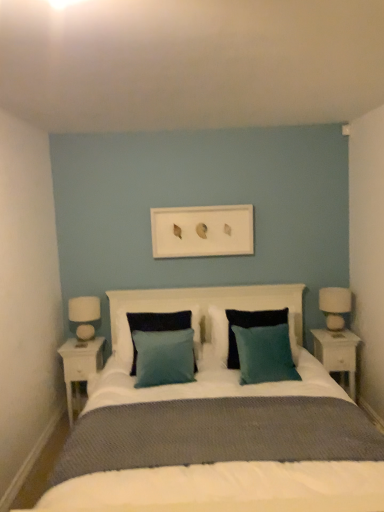
Question: Which direction should I rotate to look at teal fabric pillow at center, placed as the 2th pillow when sorted from right to left?

Choices:
 (A) left
 (B) right

Answer: (B)

Question: Is teal fabric pillow at center, which ranks as the first pillow in right-to-left order, surrounding white wood nightstand at left, the 1th nightstand positioned from the left?

Choices:
 (A) yes
 (B) no

Answer: (B)

Question: Is teal fabric pillow at center, the third pillow positioned from the left, behind white wood nightstand at left, acting as the 2th nightstand starting from the right?

Choices:
 (A) no
 (B) yes

Answer: (A)

Question: Does teal fabric pillow at center, which ranks as the first pillow in right-to-left order, have a lesser width compared to white wood nightstand at left, the 1th nightstand positioned from the left?

Choices:
 (A) yes
 (B) no

Answer: (B)

Question: From a real-world perspective, is teal fabric pillow at center, which ranks as the first pillow in right-to-left order, on top of white wood nightstand at left, the 1th nightstand positioned from the left?

Choices:
 (A) no
 (B) yes

Answer: (B)

Question: From a real-world perspective, is teal fabric pillow at center, the third pillow positioned from the left, below white wood nightstand at left, the 1th nightstand positioned from the left?

Choices:
 (A) no
 (B) yes

Answer: (A)

Question: Considering the relative sizes of teal fabric pillow at center, the third pillow positioned from the left, and white wood nightstand at left, acting as the 2th nightstand starting from the right, in the image provided, is teal fabric pillow at center, the third pillow positioned from the left, wider than white wood nightstand at left, acting as the 2th nightstand starting from the right,?

Choices:
 (A) yes
 (B) no

Answer: (A)

Question: Is white glossy table lamp at left to the right of teal fabric pillow at center, the third pillow positioned from the left, from the viewer's perspective?

Choices:
 (A) no
 (B) yes

Answer: (A)

Question: Considering the relative sizes of white glossy table lamp at left and teal fabric pillow at center, which ranks as the first pillow in right-to-left order, in the image provided, is white glossy table lamp at left shorter than teal fabric pillow at center, which ranks as the first pillow in right-to-left order,?

Choices:
 (A) yes
 (B) no

Answer: (A)

Question: Is teal fabric pillow at center, the third pillow positioned from the left, completely or partially inside white glossy table lamp at left?

Choices:
 (A) no
 (B) yes

Answer: (A)

Question: Does white glossy table lamp at left have a greater height compared to teal fabric pillow at center, which ranks as the first pillow in right-to-left order?

Choices:
 (A) no
 (B) yes

Answer: (A)

Question: Is white glossy table lamp at left wider than teal fabric pillow at center, which ranks as the first pillow in right-to-left order?

Choices:
 (A) yes
 (B) no

Answer: (B)

Question: Can you confirm if white glossy table lamp at left is positioned to the left of teal fabric pillow at center, the third pillow positioned from the left?

Choices:
 (A) yes
 (B) no

Answer: (A)

Question: Does teal fabric pillow at center, which is the 3th pillow in right-to-left order, have a greater height compared to teal fabric pillow at center, which ranks as the first pillow in right-to-left order?

Choices:
 (A) no
 (B) yes

Answer: (A)